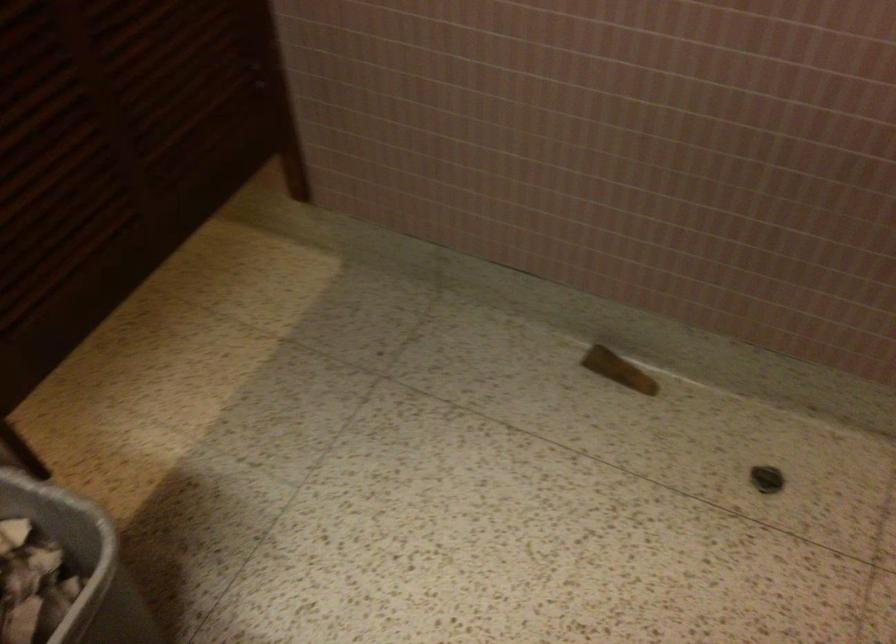
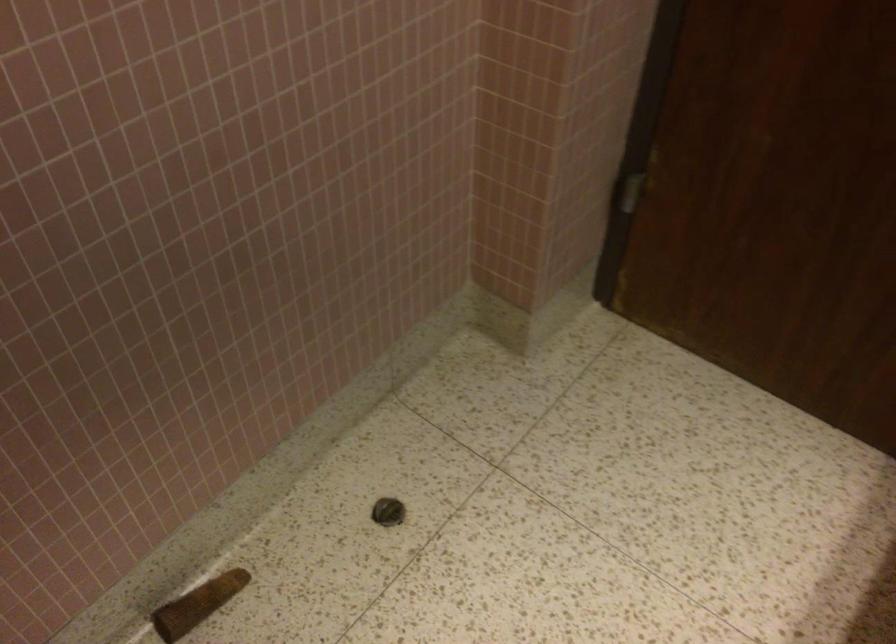
Based on the continuous images, in which direction is the camera rotating?

The rotation direction of the camera is right-down.